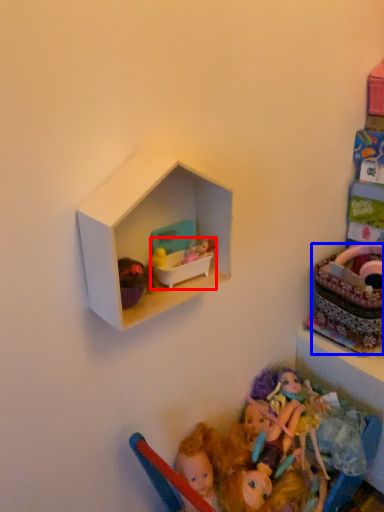
Question: Which object is closer to the camera taking this photo, toy (highlighted by a red box) or basket (highlighted by a blue box)?

Choices:
 (A) toy
 (B) basket

Answer: (A)